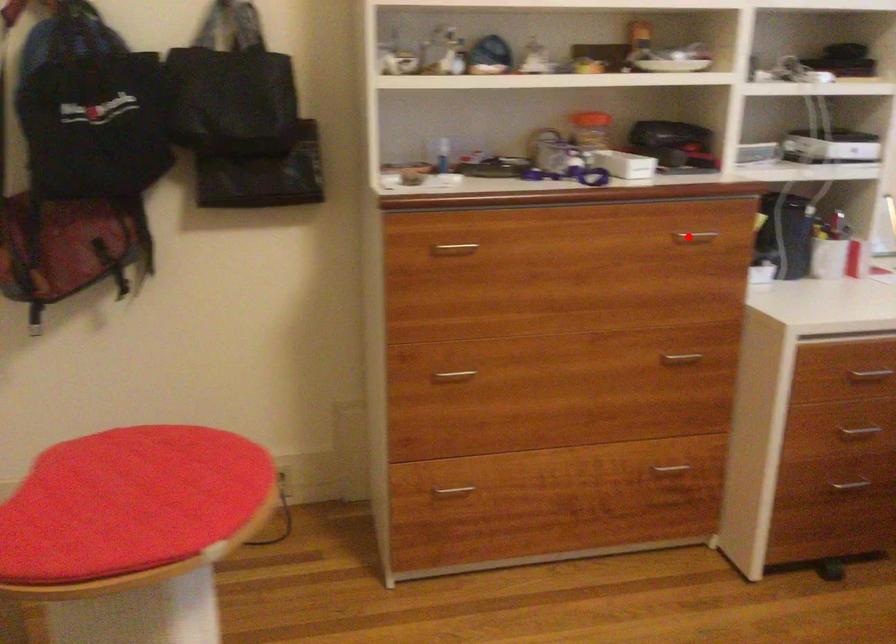
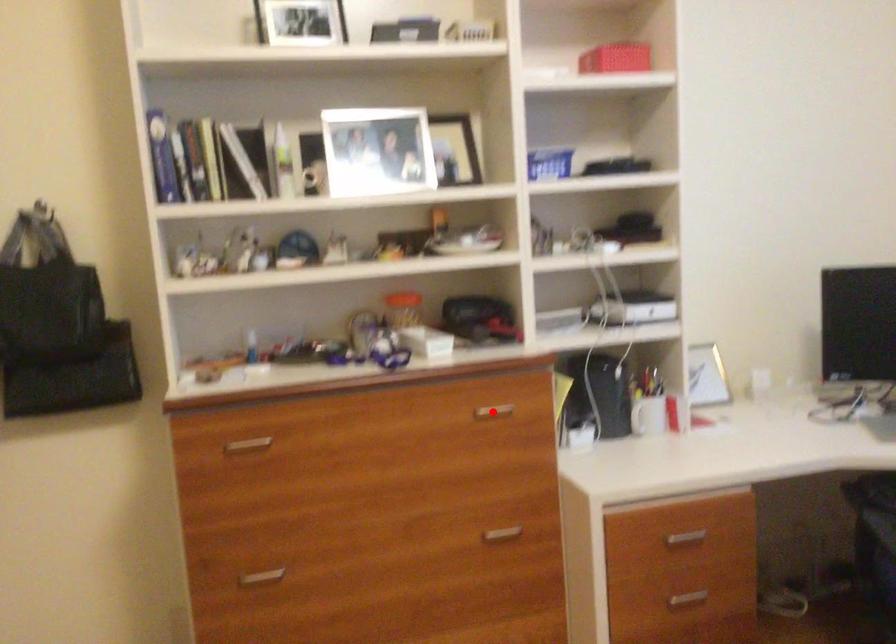
I am providing you with two images of the same scene from different viewpoints. A red point is marked on the first image and another point is marked on the second image. Do the highlighted points in image1 and image2 indicate the same real-world spot?

Yes